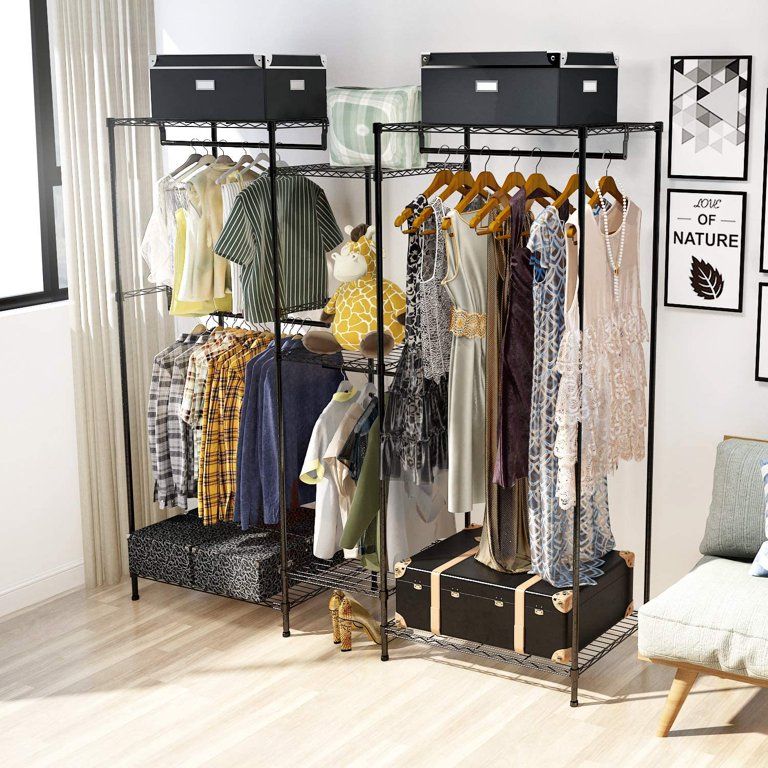
Identify the location of hangers right side. Image resolution: width=768 pixels, height=768 pixels. (607, 167), (578, 164), (538, 163), (515, 154), (487, 154), (461, 154), (445, 154).